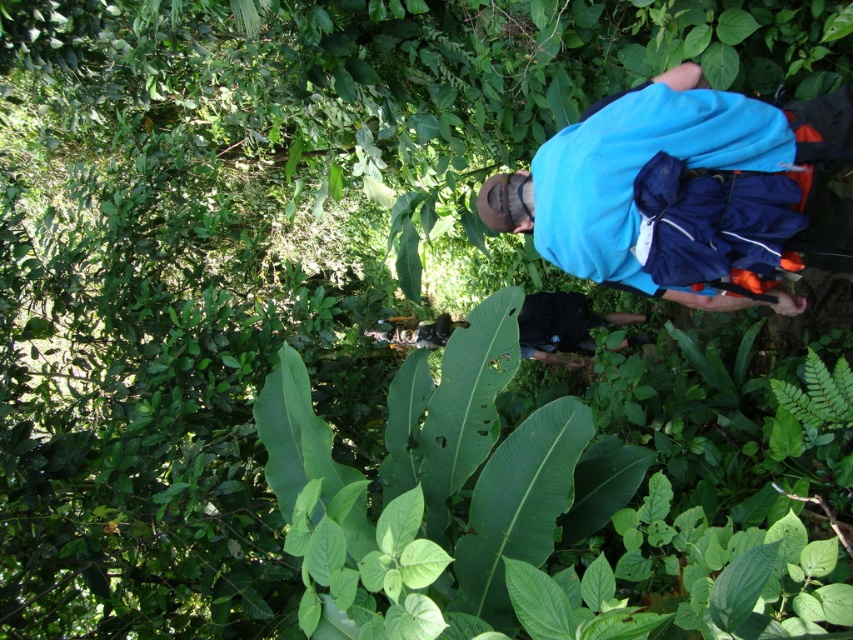
Who is higher up, blue fabric backpack at center or black fabric backpack at center?

blue fabric backpack at center is above.

Does point (555, 154) come farther from viewer compared to point (428, 321)?

That is False.

This screenshot has width=853, height=640. I want to click on blue fabric backpack at center, so click(x=683, y=192).

In order to click on blue fabric backpack at center in this screenshot , I will do `click(683, 192)`.